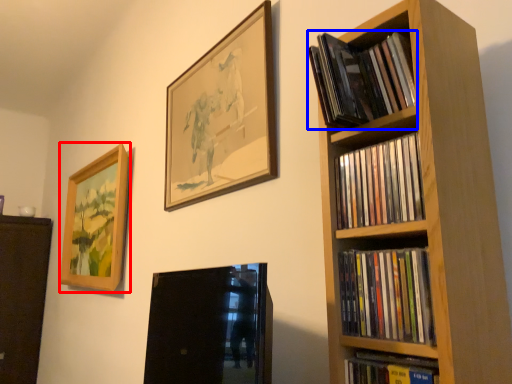
Question: Which object appears closest to the camera in this image, picture frame (highlighted by a red box) or book (highlighted by a blue box)?

Choices:
 (A) picture frame
 (B) book

Answer: (B)